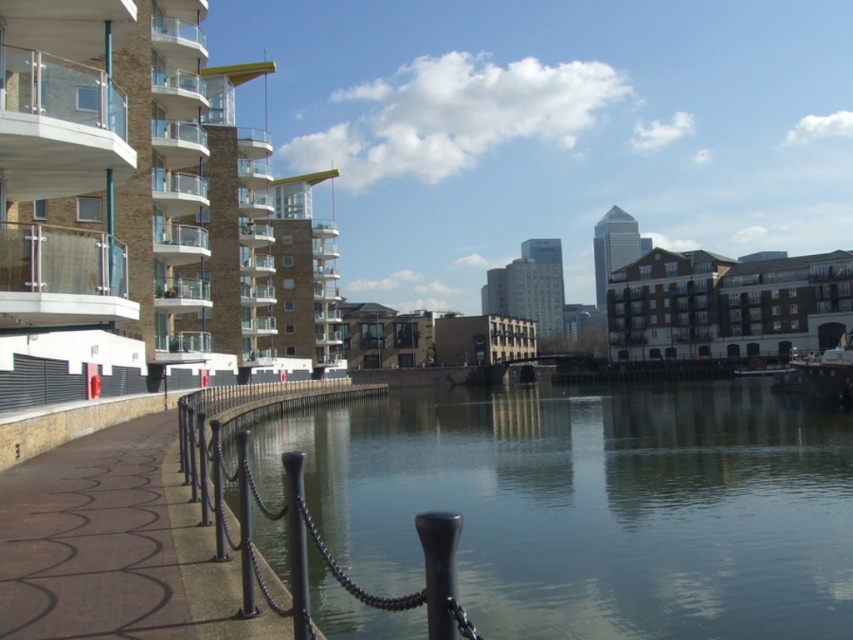
Is greenish-gray water at center in front of brown textured pavement at lower left?

Yes, it is.

Is greenish-gray water at center positioned at the back of brown textured pavement at lower left?

That is False.

Who is more distant from viewer, [364,483] or [129,608]?

Point [364,483]

Image resolution: width=853 pixels, height=640 pixels. I want to click on greenish-gray water at center, so click(x=590, y=504).